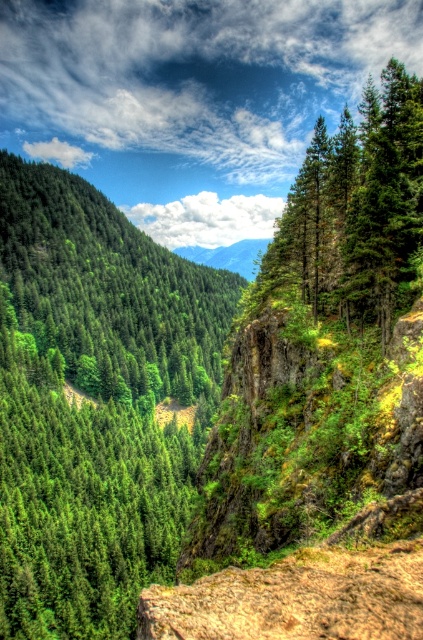
Question: Observing the image, what is the correct spatial positioning of green matte tree at upper right in reference to green textured mountain at center?

Choices:
 (A) right
 (B) left

Answer: (A)

Question: Which object appears farthest from the camera in this image?

Choices:
 (A) green matte tree at upper right
 (B) green textured mountain at center

Answer: (B)

Question: Is green matte tree at upper right thinner than green textured mountain at center?

Choices:
 (A) no
 (B) yes

Answer: (A)

Question: Which object is the closest to the green matte tree at upper right?

Choices:
 (A) green textured mountain at center
 (B) green matte tree at left

Answer: (B)

Question: Which point is closer to the camera?

Choices:
 (A) green matte tree at left
 (B) green matte tree at upper right
 (C) green textured mountain at center

Answer: (B)

Question: Can you confirm if green matte tree at left is positioned below green textured mountain at center?

Choices:
 (A) yes
 (B) no

Answer: (A)